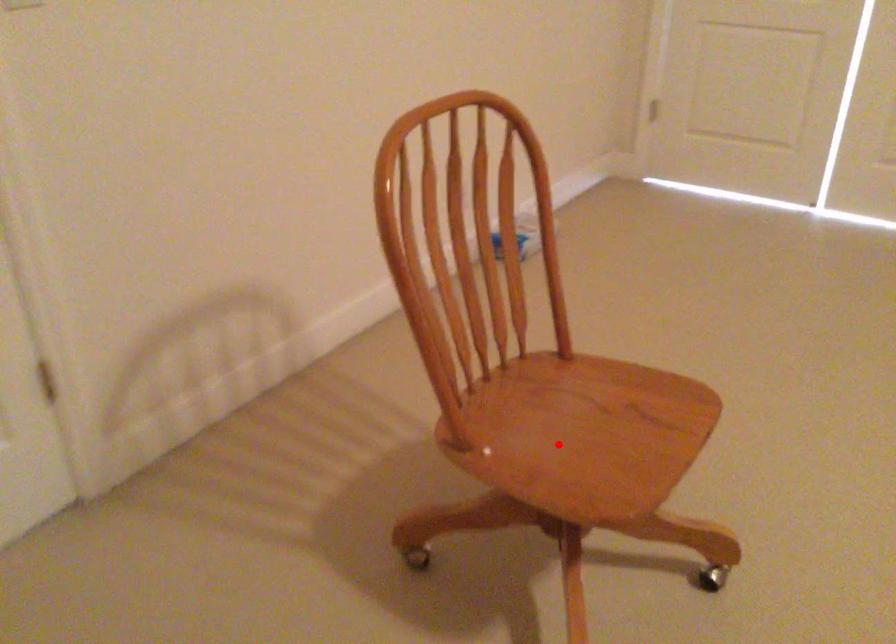
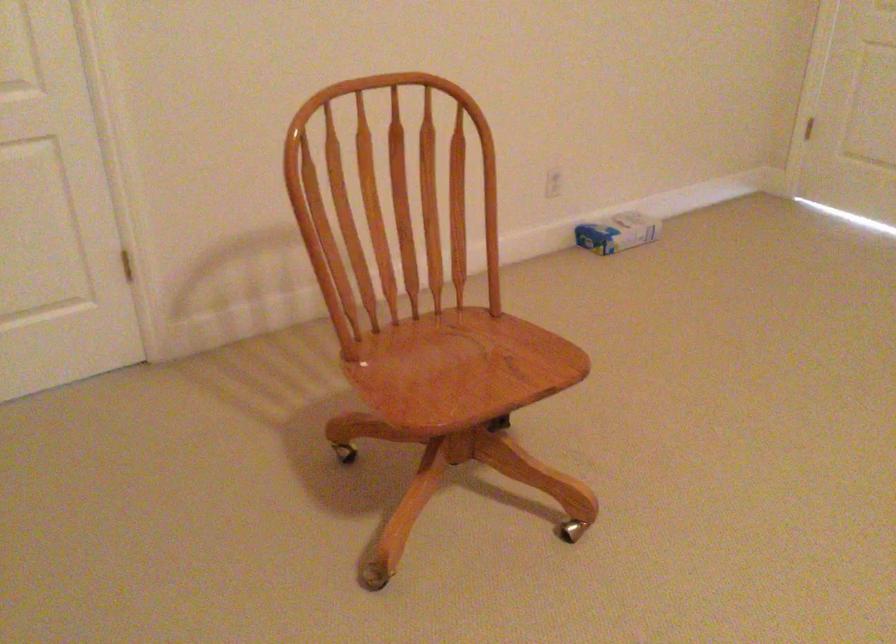
Question: I am providing you with two images of the same scene from different viewpoints. In image1, a red point is highlighted. Considering the same 3D point in image2, which of the following is correct?

Choices:
 (A) It is closer
 (B) It is farther

Answer: (B)